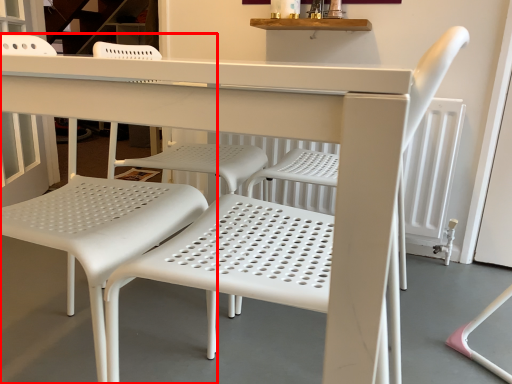
Question: From the image's perspective, what is the correct spatial relationship of chair (annotated by the red box) in relation to chair?

Choices:
 (A) below
 (B) above

Answer: (B)